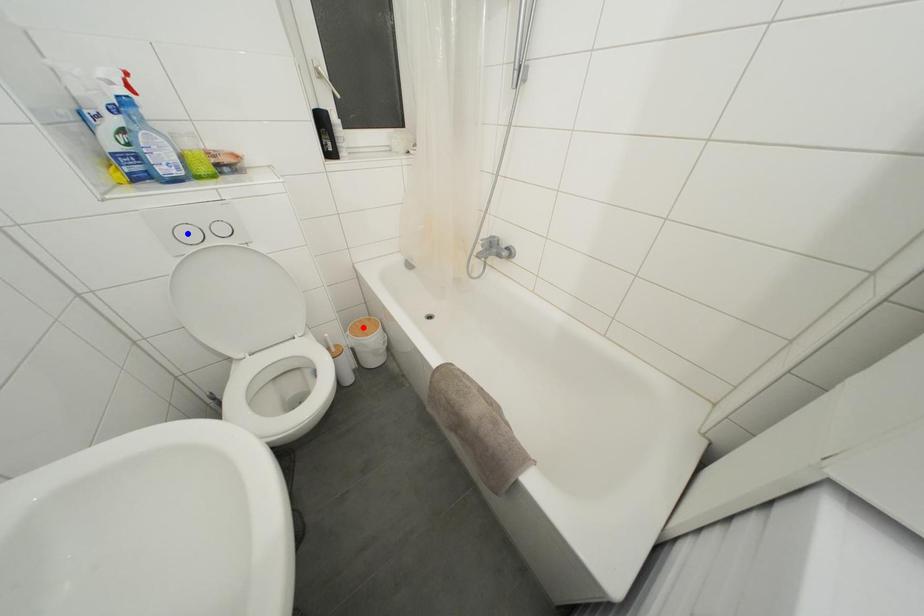
Question: Two points are marked on the image. Which point is closer to the camera?

Choices:
 (A) Blue point is closer.
 (B) Red point is closer.

Answer: (A)